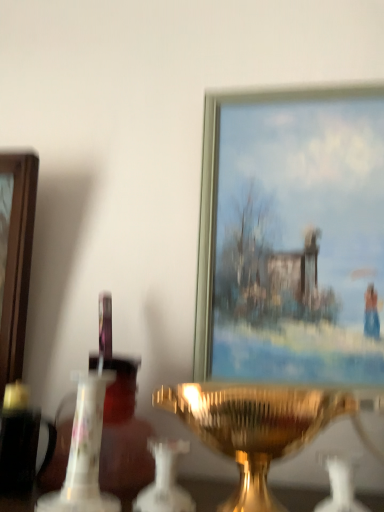
Question: Is white porcelain candle holder at center, acting as the 1th candle holder starting from the left, further to camera compared to white glass candle holder at center, the third candle holder in the left-to-right sequence?

Choices:
 (A) yes
 (B) no

Answer: (A)

Question: From the image's perspective, is white porcelain candle holder at center, which is the third candle holder in right-to-left order, below white glass candle holder at center, the third candle holder in the left-to-right sequence?

Choices:
 (A) yes
 (B) no

Answer: (B)

Question: Is white porcelain candle holder at center, acting as the 1th candle holder starting from the left, wider than white glass candle holder at center, the third candle holder in the left-to-right sequence?

Choices:
 (A) yes
 (B) no

Answer: (A)

Question: Could you tell me if white porcelain candle holder at center, acting as the 1th candle holder starting from the left, is turned towards white glass candle holder at center, the first candle holder when ordered from right to left?

Choices:
 (A) no
 (B) yes

Answer: (A)

Question: Considering the relative sizes of white porcelain candle holder at center, acting as the 1th candle holder starting from the left, and white glass candle holder at center, the first candle holder when ordered from right to left, in the image provided, is white porcelain candle holder at center, acting as the 1th candle holder starting from the left, thinner than white glass candle holder at center, the first candle holder when ordered from right to left,?

Choices:
 (A) yes
 (B) no

Answer: (B)

Question: In terms of width, does white glass candle holder at center, the third candle holder in the left-to-right sequence, look wider or thinner when compared to white porcelain candle holder at center, acting as the 1th candle holder starting from the left?

Choices:
 (A) thin
 (B) wide

Answer: (A)

Question: Is white glass candle holder at center, the third candle holder in the left-to-right sequence, situated inside white porcelain candle holder at center, which is the third candle holder in right-to-left order, or outside?

Choices:
 (A) outside
 (B) inside

Answer: (A)

Question: Based on their sizes in the image, would you say white glass candle holder at center, the first candle holder when ordered from right to left, is bigger or smaller than white porcelain candle holder at center, acting as the 1th candle holder starting from the left?

Choices:
 (A) small
 (B) big

Answer: (A)

Question: Visually, is white glass candle holder at center, the first candle holder when ordered from right to left, positioned to the left or to the right of white porcelain candle holder at center, acting as the 1th candle holder starting from the left?

Choices:
 (A) right
 (B) left

Answer: (A)

Question: Is gold metallic candle holder at center, the second candle holder in the left-to-right sequence, bigger or smaller than white glass candle holder at center, the first candle holder when ordered from right to left?

Choices:
 (A) small
 (B) big

Answer: (B)

Question: From the image's perspective, relative to white glass candle holder at center, the third candle holder in the left-to-right sequence, is gold metallic candle holder at center, the second candle holder in the left-to-right sequence, above or below?

Choices:
 (A) above
 (B) below

Answer: (A)

Question: From a real-world perspective, is gold metallic candle holder at center, the 2th candle holder when ordered from right to left, above or below white glass candle holder at center, the first candle holder when ordered from right to left?

Choices:
 (A) above
 (B) below

Answer: (A)

Question: In terms of width, does gold metallic candle holder at center, the second candle holder in the left-to-right sequence, look wider or thinner when compared to white glass candle holder at center, the third candle holder in the left-to-right sequence?

Choices:
 (A) wide
 (B) thin

Answer: (A)

Question: In terms of height, does white glass candle holder at center, the first candle holder when ordered from right to left, look taller or shorter compared to metallic gold picture frame at upper center?

Choices:
 (A) tall
 (B) short

Answer: (B)

Question: In terms of size, does white glass candle holder at center, the third candle holder in the left-to-right sequence, appear bigger or smaller than metallic gold picture frame at upper center?

Choices:
 (A) big
 (B) small

Answer: (B)